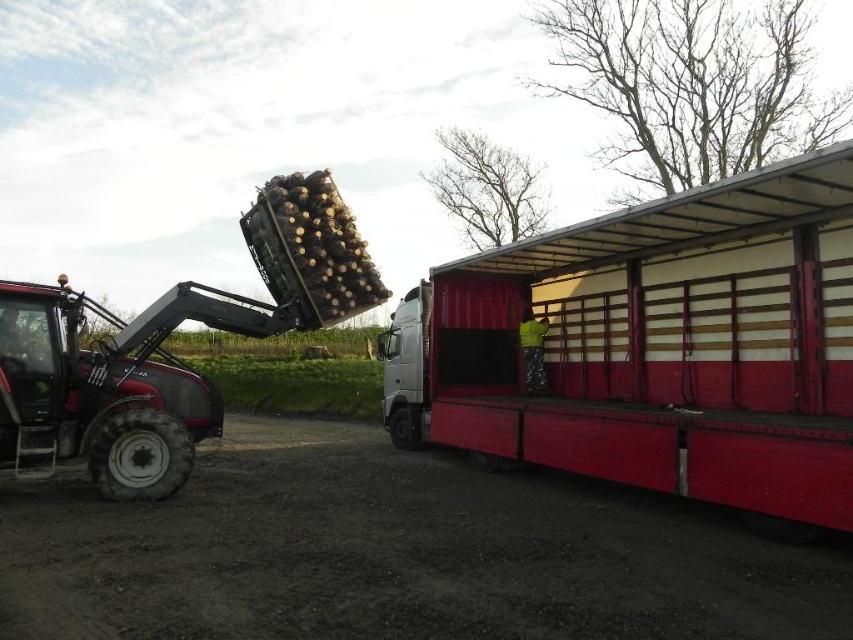
You are a delivery driver who needs to park your vehicle in the space next to the matte black tractor at left. Based on the scene, which side of the metallic red truck at center should you park on to be adjacent to the tractor?

A: You should park to the left side of the metallic red truck at center because it is positioned to the right of the matte black tractor at left, meaning the tractor is on the left side of the truck. Therefore, parking on the truck left side will place you next to the tractor.

You are standing at the origin point of the coordinate system. You see the point at coordinate point (656,346). What object is located at that coordinate point?

The point at coordinate point 0.540, 0.770 corresponds to the metallic red truck at center.